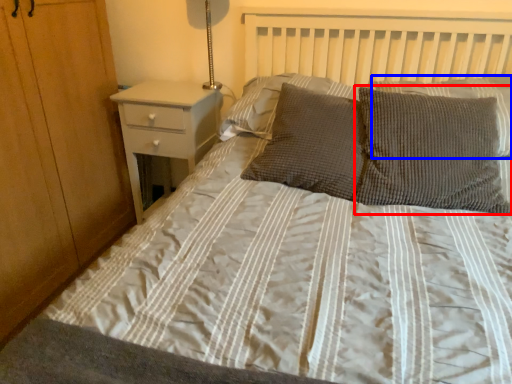
Question: Which of the following is the farthest to the observer, pillow (highlighted by a red box) or pillow (highlighted by a blue box)?

Choices:
 (A) pillow
 (B) pillow

Answer: (B)